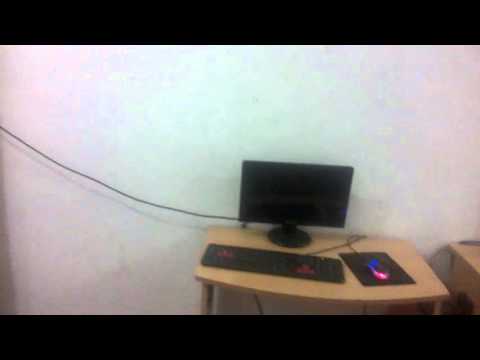
I want to click on empty space on table, so click(x=399, y=245).